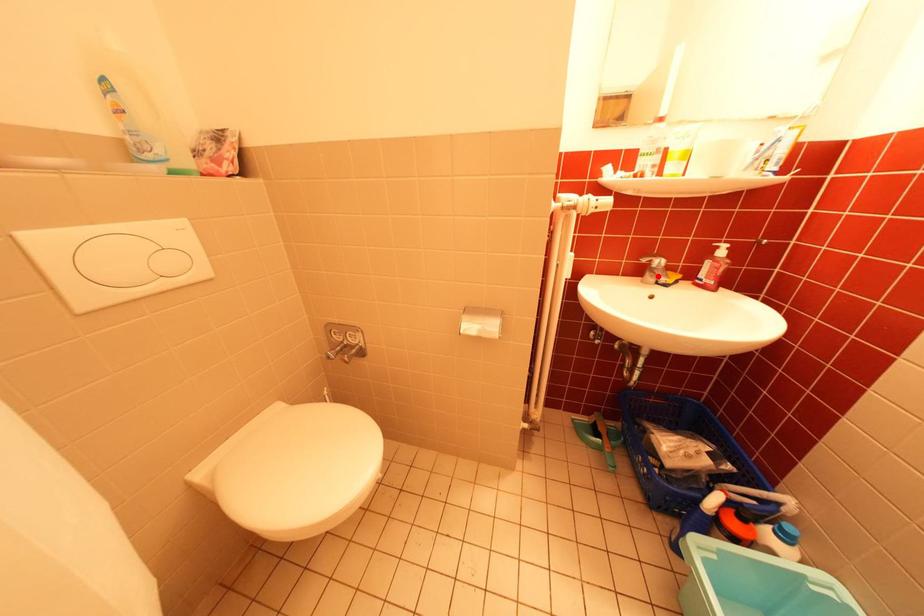
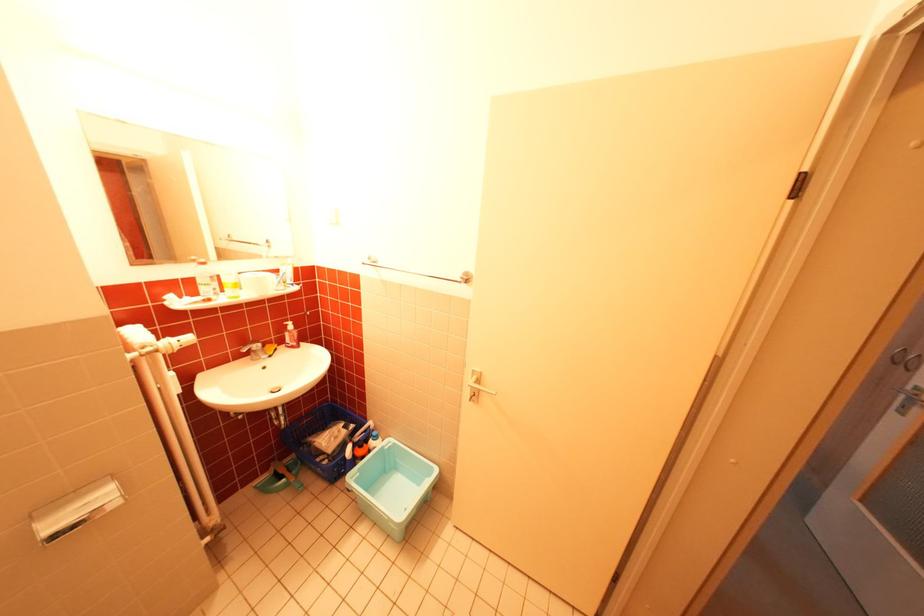
Where in the second image is the point corresponding to the highlighted location from the first image?

(263, 355)